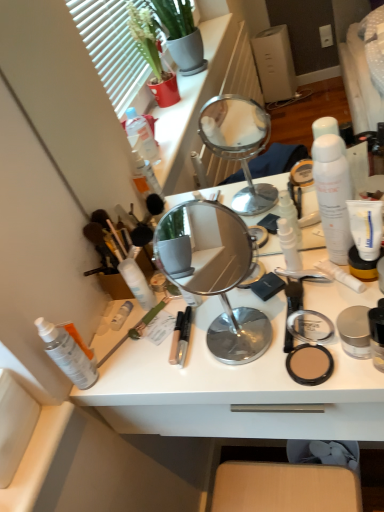
You are a GUI agent. You are given a task and a screenshot of the screen. Output one action in this format:
    pyautogui.click(x=<x>, y=<y>)
    Task: Click on the free location in front of white matte lotion at center, which is counted as the 4th toiletry, starting from the right
    
    Given the screenshot: What is the action you would take?
    pyautogui.click(x=146, y=362)